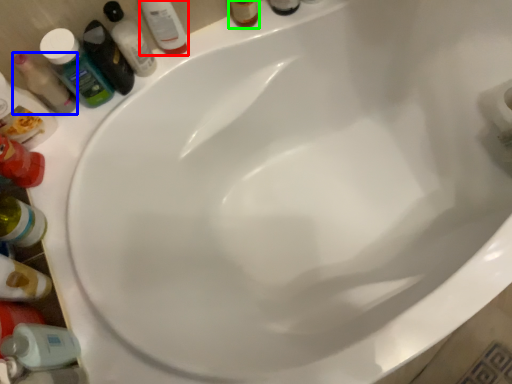
Question: Estimate the real-world distances between objects in this image. Which object is farther from mouthwash (highlighted by a red box), mouthwash (highlighted by a blue box) or toiletry (highlighted by a green box)?

Choices:
 (A) mouthwash
 (B) toiletry

Answer: (A)